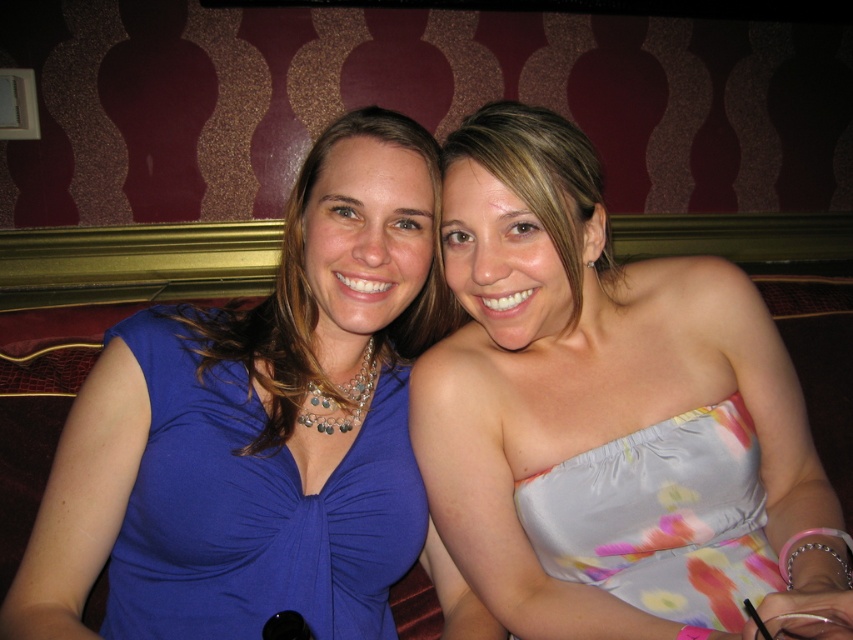
You are a photographer trying to capture a closeup of the blue satin dress at center and the matte blue dress at center. Which dress should you focus on first if you want to take a photo from left to right?

The blue satin dress at center should be focused on first because it is positioned to the left of the matte blue dress at center, making it the first element encountered when moving from left to right.

You are standing in front of a wall with a maroon and gold pattern. You want to take a photo of the point at coordinates point [689,470]. If your camera can focus on objects within 90 centimeters, will it be able to capture the point clearly?

The point [689,470] is 87.36 centimeters away from the camera, which is within the 90 centimeter focus range. Therefore, the camera can capture the point clearly.